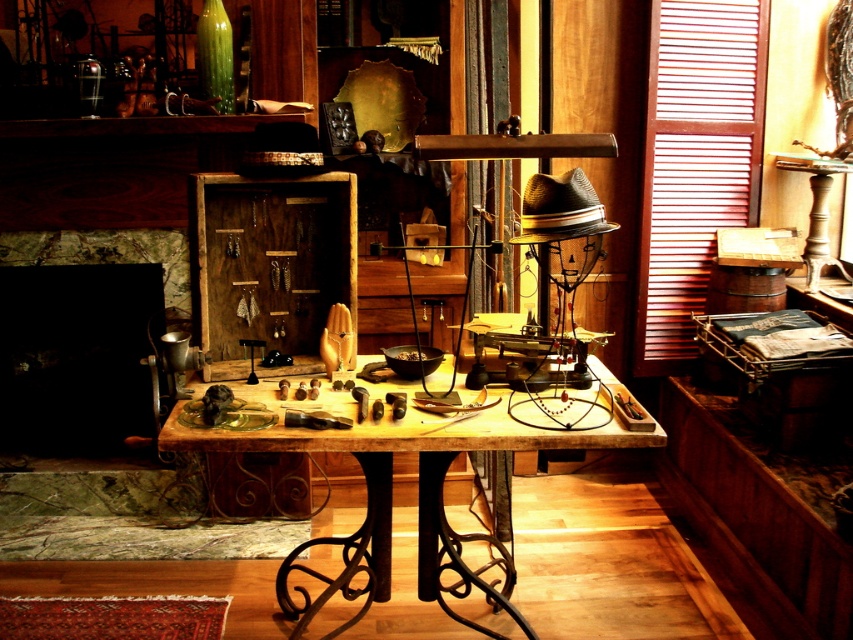
Is point (22, 401) less distant than point (381, 424)?

No, it is behind (381, 424).

Image resolution: width=853 pixels, height=640 pixels. Identify the location of black matte fireplace at lower left. (83, 337).